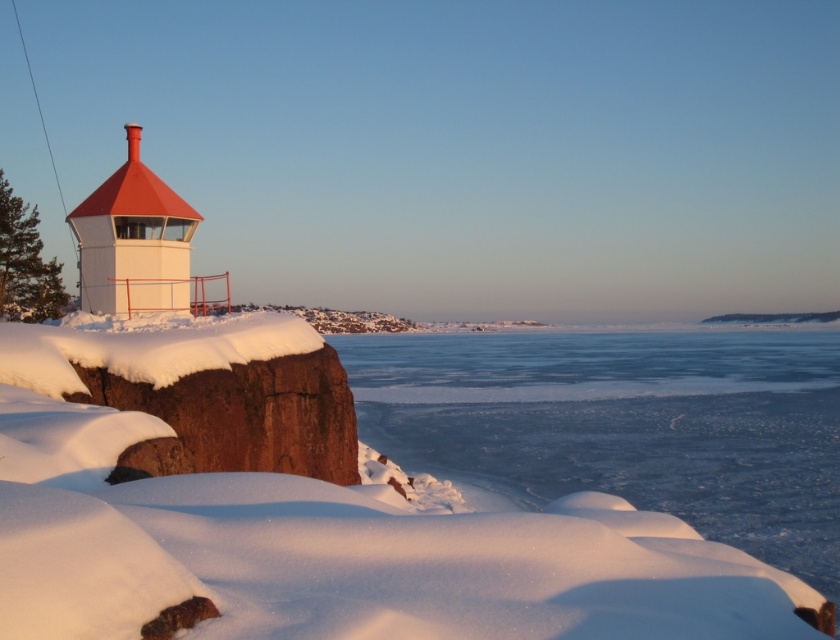
Question: Which object appears closest to the camera in this image?

Choices:
 (A) matte white tower at left
 (B) frozen ice at lower center

Answer: (B)

Question: Does frozen ice at lower center have a lesser width compared to matte white tower at left?

Choices:
 (A) no
 (B) yes

Answer: (A)

Question: Among these objects, which one is nearest to the camera?

Choices:
 (A) matte white tower at left
 (B) frozen ice at lower center

Answer: (B)

Question: Which point is farther from the camera taking this photo?

Choices:
 (A) (786, 458)
 (B) (142, 168)

Answer: (A)

Question: Does frozen ice at lower center appear under matte white tower at left?

Choices:
 (A) no
 (B) yes

Answer: (B)

Question: Is frozen ice at lower center below matte white tower at left?

Choices:
 (A) no
 (B) yes

Answer: (B)